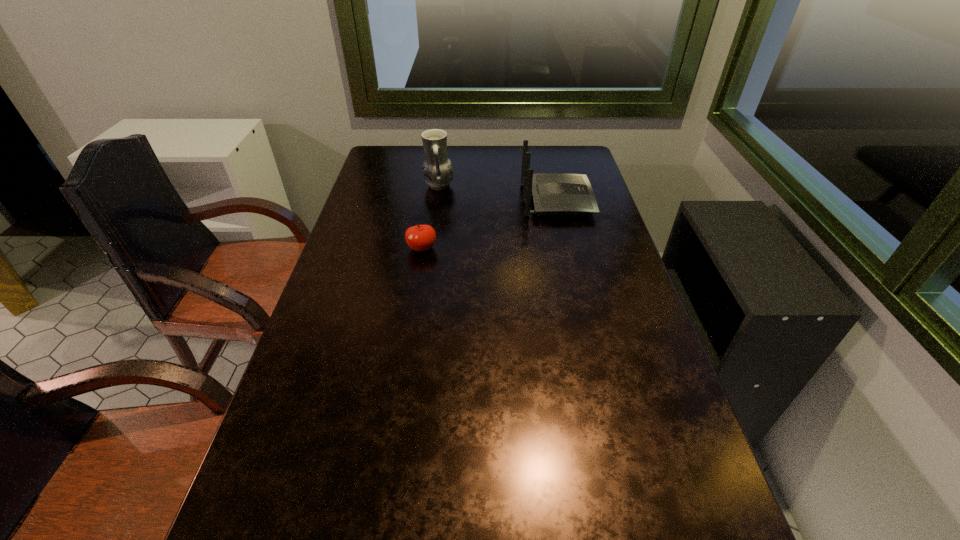
The height and width of the screenshot is (540, 960). I want to click on free space at the right edge of the desktop, so click(632, 478).

The width and height of the screenshot is (960, 540). Identify the location of vacant space at the far right corner. (553, 166).

Locate an element on the screen. unoccupied area between the nearest object and the rightmost object is located at coordinates (490, 224).

Identify the location of vacant space that is in between the router and the pottery. (498, 193).

Image resolution: width=960 pixels, height=540 pixels. I want to click on empty location between the router and the nearest object, so click(490, 224).

Where is `unoccupied area between the router and the apple`? This screenshot has height=540, width=960. unoccupied area between the router and the apple is located at coordinates (490, 224).

At what (x,y) coordinates should I click in order to perform the action: click on the closest object relative to the pottery. Please return your answer as a coordinate pair (x, y). The width and height of the screenshot is (960, 540). Looking at the image, I should click on (553, 193).

Locate which object is the second closest to the router. Please provide its 2D coordinates. Your answer should be formatted as a tuple, i.e. [(x, y)], where the tuple contains the x and y coordinates of a point satisfying the conditions above.

[(421, 237)]

This screenshot has width=960, height=540. What are the coordinates of `free space that satisfies the following two spatial constraints: 1. on the back side of the shortest object; 2. on the left side of the pottery` in the screenshot? It's located at (432, 186).